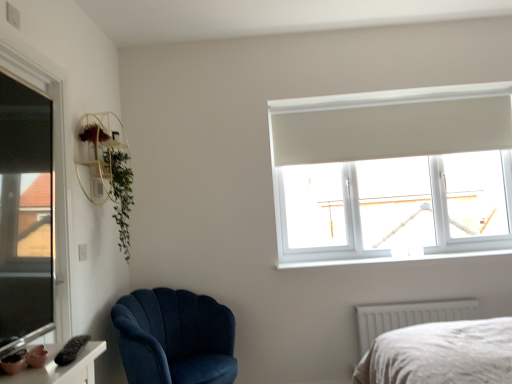
This screenshot has width=512, height=384. What do you see at coordinates (61, 368) in the screenshot?
I see `matte pink ceramic at lower left` at bounding box center [61, 368].

The width and height of the screenshot is (512, 384). Identify the location of transparent glass window at left, which is the second window in back-to-front order. (32, 204).

What do you see at coordinates (32, 204) in the screenshot? The height and width of the screenshot is (384, 512). I see `transparent glass window at left, which appears as the 1th window when viewed from the front` at bounding box center [32, 204].

Describe the element at coordinates (98, 154) in the screenshot. The height and width of the screenshot is (384, 512). I see `gold metallic shelf at upper left` at that location.

Locate an element on the screen. The height and width of the screenshot is (384, 512). white plastic window sill at upper right is located at coordinates (392, 259).

Where is `matte pink ceramic at lower left`? This screenshot has width=512, height=384. matte pink ceramic at lower left is located at coordinates (61, 368).

How much distance is there between velvet blue armchair at lower left and green leafy plant at upper left?

velvet blue armchair at lower left is 27.04 inches from green leafy plant at upper left.

How many degrees apart are the facing directions of velvet blue armchair at lower left and green leafy plant at upper left?

velvet blue armchair at lower left and green leafy plant at upper left are facing 20.7 degrees away from each other.

Is velvet blue armchair at lower left smaller than green leafy plant at upper left?

Incorrect, velvet blue armchair at lower left is not smaller in size than green leafy plant at upper left.

Between point (146, 350) and point (126, 222), which one is positioned in front?

The point (146, 350) is closer to the camera.

Which object is further away from the camera taking this photo, green leafy plant at upper left or matte pink ceramic at lower left?

green leafy plant at upper left is further away from the camera.

Consider the image. Considering the positions of objects green leafy plant at upper left and matte pink ceramic at lower left in the image provided, who is more to the right, green leafy plant at upper left or matte pink ceramic at lower left?

matte pink ceramic at lower left.

Would you say green leafy plant at upper left is a long distance from matte pink ceramic at lower left?

Yes.

You are a GUI agent. You are given a task and a screenshot of the screen. Output one action in this format:
    pyautogui.click(x=<x>, y=<y>)
    Task: Click on the table that appears in front of the green leafy plant at upper left
    
    Given the screenshot: What is the action you would take?
    pyautogui.click(x=61, y=368)

From the picture: How many degrees apart are the facing directions of transparent glass window at left, the 1th window from the left, and green leafy plant at upper left?

The facing directions of transparent glass window at left, the 1th window from the left, and green leafy plant at upper left are 0.94 degrees apart.

Which object is further away from the camera taking this photo, transparent glass window at left, which is the 2th window from right to left, or green leafy plant at upper left?

green leafy plant at upper left.

Consider the image. Who is taller, transparent glass window at left, which is the 2th window from right to left, or green leafy plant at upper left?

Standing taller between the two is transparent glass window at left, which is the 2th window from right to left.

Is green leafy plant at upper left inside transparent glass window at left, which is the 2th window from right to left?

No, green leafy plant at upper left is not a part of transparent glass window at left, which is the 2th window from right to left.

Does gold metallic shelf at upper left turn towards white textured radiator at lower right?

No, gold metallic shelf at upper left does not turn towards white textured radiator at lower right.

Locate an element on the screen. The width and height of the screenshot is (512, 384). radiator that appears on the right of gold metallic shelf at upper left is located at coordinates (409, 316).

Is gold metallic shelf at upper left not within white textured radiator at lower right?

Yes, gold metallic shelf at upper left is not within white textured radiator at lower right.

Is point (80, 168) in front of point (428, 312)?

Yes, it is.

Relative to white plastic window sill at upper right, is green leafy plant at upper left in front or behind?

Clearly, green leafy plant at upper left is in front of white plastic window sill at upper right.

Considering the sizes of objects green leafy plant at upper left and white plastic window sill at upper right in the image provided, who is bigger, green leafy plant at upper left or white plastic window sill at upper right?

green leafy plant at upper left is bigger.

Is green leafy plant at upper left aimed at white plastic window sill at upper right?

No.

Can you confirm if green leafy plant at upper left is thinner than white plastic window sill at upper right?

Yes, green leafy plant at upper left is thinner than white plastic window sill at upper right.

Considering the relative sizes of white plastic window sill at upper right and transparent glass window at left, the 1th window from the left, in the image provided, is white plastic window sill at upper right shorter than transparent glass window at left, the 1th window from the left,?

Indeed, white plastic window sill at upper right has a lesser height compared to transparent glass window at left, the 1th window from the left.

From a real-world perspective, is white plastic window sill at upper right physically above transparent glass window at left, which is the 2th window from right to left?

Incorrect, from a real-world perspective, white plastic window sill at upper right is lower than transparent glass window at left, which is the 2th window from right to left.

At what (x,y) coordinates should I click in order to perform the action: click on window on the left of the white plastic window sill at upper right. Please return your answer as a coordinate pair (x, y). This screenshot has width=512, height=384. Looking at the image, I should click on (32, 204).

Is white plastic window sill at upper right directly adjacent to transparent glass window at left, the 1th window from the left?

white plastic window sill at upper right is not next to transparent glass window at left, the 1th window from the left, and they're not touching.

From the image's perspective, is matte pink ceramic at lower left below white textured radiator at lower right?

Actually, matte pink ceramic at lower left appears above white textured radiator at lower right in the image.

Is matte pink ceramic at lower left facing towards white textured radiator at lower right?

No, matte pink ceramic at lower left does not turn towards white textured radiator at lower right.

Is matte pink ceramic at lower left taller or shorter than white textured radiator at lower right?

Clearly, matte pink ceramic at lower left is shorter compared to white textured radiator at lower right.

Is matte pink ceramic at lower left bigger or smaller than white textured radiator at lower right?

matte pink ceramic at lower left is smaller than white textured radiator at lower right.

Where is `chair that is below the green leafy plant at upper left (from the image's perspective)`? The height and width of the screenshot is (384, 512). chair that is below the green leafy plant at upper left (from the image's perspective) is located at coordinates (174, 337).

Find the location of a particular element. table on the right of green leafy plant at upper left is located at coordinates (61, 368).

Estimate the real-world distances between objects in this image. Which object is closer to velvet blue armchair at lower left, white plastic window sill at upper right or white textured radiator at lower right?

Based on the image, white plastic window sill at upper right appears to be nearer to velvet blue armchair at lower left.

Looking at this image, which object lies further to the anchor point transparent glass window at left, which appears as the 1th window when viewed from the front, velvet blue armchair at lower left or gold metallic shelf at upper left?

velvet blue armchair at lower left is further to transparent glass window at left, which appears as the 1th window when viewed from the front.

Estimate the real-world distances between objects in this image. Which object is closer to transparent glass window at upper right, which is the 1th window in back-to-front order, matte pink ceramic at lower left or gold metallic shelf at upper left?

gold metallic shelf at upper left is closer to transparent glass window at upper right, which is the 1th window in back-to-front order.

Which object lies nearer to the anchor point matte pink ceramic at lower left, gold metallic shelf at upper left or green leafy plant at upper left?

gold metallic shelf at upper left.

Which object lies further to the anchor point green leafy plant at upper left, white textured radiator at lower right or matte pink ceramic at lower left?

white textured radiator at lower right is positioned further to the anchor green leafy plant at upper left.

Consider the image. Which object lies further to the anchor point transparent glass window at left, which is the second window in back-to-front order, matte pink ceramic at lower left or green leafy plant at upper left?

matte pink ceramic at lower left.

Which object lies further to the anchor point velvet blue armchair at lower left, matte pink ceramic at lower left or green leafy plant at upper left?

The object further to velvet blue armchair at lower left is matte pink ceramic at lower left.

When comparing their distances from matte pink ceramic at lower left, does white plastic window sill at upper right or white textured radiator at lower right seem further?

Among the two, white textured radiator at lower right is located further to matte pink ceramic at lower left.

Identify the location of plant between matte pink ceramic at lower left and white plastic window sill at upper right along the z-axis. The image size is (512, 384). (121, 195).

Locate an element on the screen. table situated between transparent glass window at left, which is the second window in back-to-front order, and white textured radiator at lower right from left to right is located at coordinates (61, 368).

Image resolution: width=512 pixels, height=384 pixels. I want to click on window between matte pink ceramic at lower left and gold metallic shelf at upper left in the front-back direction, so click(32, 204).

Locate an element on the screen. This screenshot has height=384, width=512. plant between transparent glass window at left, which is the second window in back-to-front order, and transparent glass window at upper right, the first window from the right, in the horizontal direction is located at coordinates (121, 195).